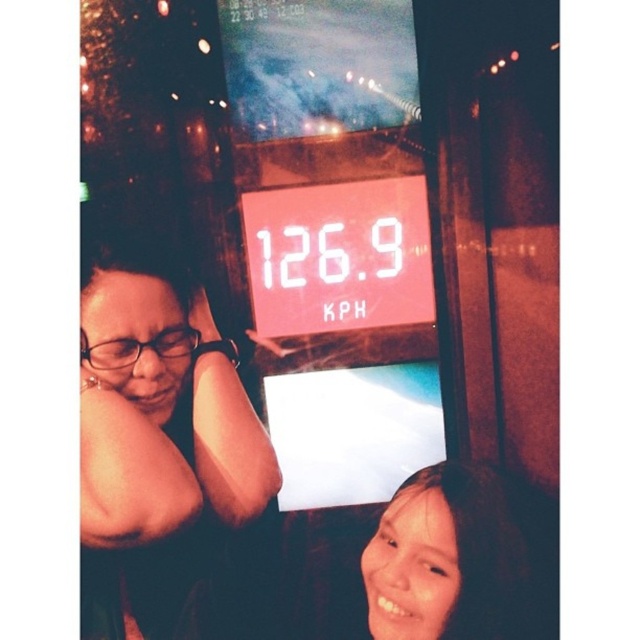
Question: Which object is closer to the camera taking this photo?

Choices:
 (A) matte black glasses at left
 (B) smooth skin face at lower right

Answer: (A)

Question: Is white digital display at center bigger than smooth skin face at lower right?

Choices:
 (A) no
 (B) yes

Answer: (A)

Question: Can you confirm if matte black glasses at left is thinner than white digital display at center?

Choices:
 (A) no
 (B) yes

Answer: (B)

Question: Considering the real-world distances, which object is closest to the smooth skin face at lower right?

Choices:
 (A) white digital display at center
 (B) matte black glasses at left

Answer: (B)

Question: Where is matte black glasses at left located in relation to white digital display at center in the image?

Choices:
 (A) below
 (B) above

Answer: (A)

Question: Which of these objects is positioned farthest from the white digital display at center?

Choices:
 (A) smooth skin face at lower right
 (B) matte black glasses at left

Answer: (A)